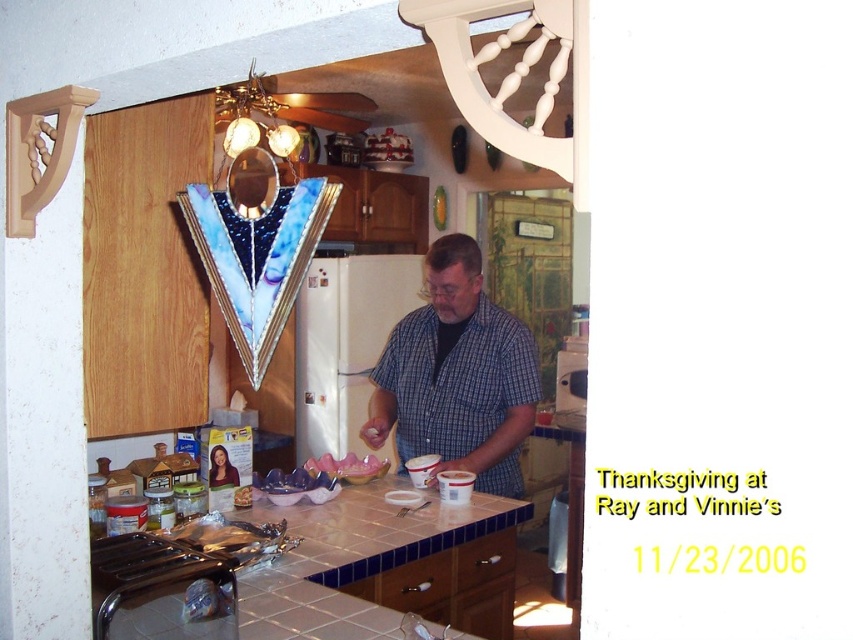
Question: Can you confirm if white tile countertop at center is positioned below blue plaid shirt at center?

Choices:
 (A) no
 (B) yes

Answer: (B)

Question: Among these points, which one is nearest to the camera?

Choices:
 (A) (491, 545)
 (B) (486, 324)

Answer: (A)

Question: Is white tile countertop at center closer to the viewer compared to blue plaid shirt at center?

Choices:
 (A) no
 (B) yes

Answer: (B)

Question: Is the position of white tile countertop at center more distant than that of blue plaid shirt at center?

Choices:
 (A) no
 (B) yes

Answer: (A)

Question: Which object appears closest to the camera in this image?

Choices:
 (A) white tile countertop at center
 (B) blue plaid shirt at center

Answer: (A)

Question: Which point is closer to the camera?

Choices:
 (A) white tile countertop at center
 (B) blue plaid shirt at center

Answer: (A)